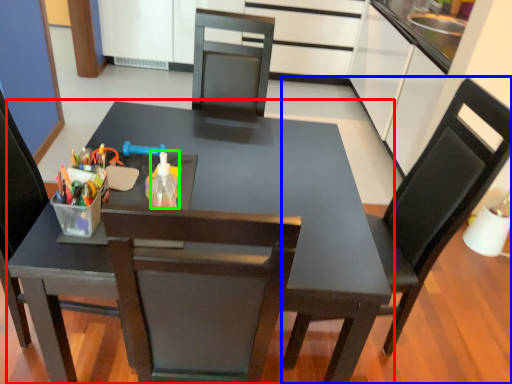
Question: Based on their relative distances, which object is farther from table (highlighted by a red box)? Choose from chair (highlighted by a blue box) and bottle (highlighted by a green box).

Choices:
 (A) chair
 (B) bottle

Answer: (A)